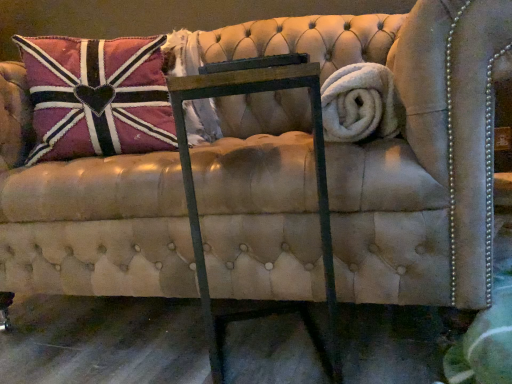
Question: Is metal frame at center closer to camera compared to velvet union jack pillow at upper left?

Choices:
 (A) yes
 (B) no

Answer: (A)

Question: Could you tell me if metal frame at center is turned towards velvet union jack pillow at upper left?

Choices:
 (A) no
 (B) yes

Answer: (A)

Question: From a real-world perspective, is metal frame at center physically above velvet union jack pillow at upper left?

Choices:
 (A) yes
 (B) no

Answer: (B)

Question: Is metal frame at center to the right of velvet union jack pillow at upper left from the viewer's perspective?

Choices:
 (A) yes
 (B) no

Answer: (A)

Question: Are metal frame at center and velvet union jack pillow at upper left located far from each other?

Choices:
 (A) yes
 (B) no

Answer: (B)

Question: Considering the relative sizes of metal frame at center and velvet union jack pillow at upper left in the image provided, is metal frame at center thinner than velvet union jack pillow at upper left?

Choices:
 (A) yes
 (B) no

Answer: (B)

Question: Considering the relative sizes of white fluffy bath towel at right and velvet union jack pillow at upper left in the image provided, is white fluffy bath towel at right wider than velvet union jack pillow at upper left?

Choices:
 (A) no
 (B) yes

Answer: (A)

Question: Is white fluffy bath towel at right bigger than velvet union jack pillow at upper left?

Choices:
 (A) no
 (B) yes

Answer: (A)

Question: Does white fluffy bath towel at right have a lesser width compared to velvet union jack pillow at upper left?

Choices:
 (A) no
 (B) yes

Answer: (B)

Question: Could you tell me if white fluffy bath towel at right is turned towards velvet union jack pillow at upper left?

Choices:
 (A) yes
 (B) no

Answer: (A)

Question: Is white fluffy bath towel at right shorter than velvet union jack pillow at upper left?

Choices:
 (A) yes
 (B) no

Answer: (A)

Question: Does white fluffy bath towel at right appear on the left side of velvet union jack pillow at upper left?

Choices:
 (A) no
 (B) yes

Answer: (A)

Question: Does metal frame at center come behind white fluffy bath towel at right?

Choices:
 (A) no
 (B) yes

Answer: (A)